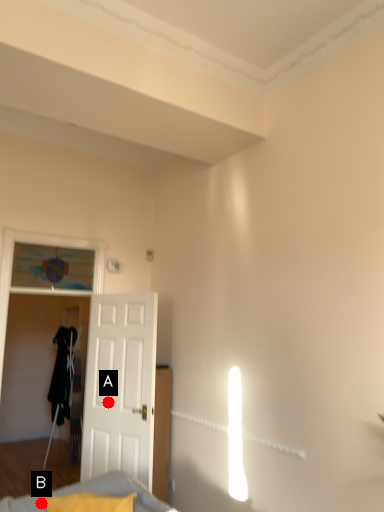
Question: Two points are circled on the image, labeled by A and B beside each circle. Which point appears farthest from the camera in this image?

Choices:
 (A) A is further
 (B) B is further

Answer: (A)